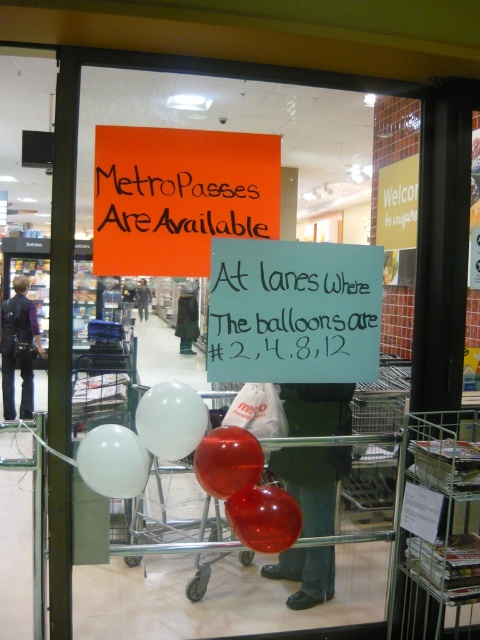
In the scene shown: You are a customer entering the store through the glass door. You see a white chalk sign at center and a glossy red balloon at center. Which object is taller?

The white chalk sign at center is much taller than the glossy red balloon at center.

You are a delivery person trying to locate the MetroPasses in the store. You see the white chalk sign at center and the matte black jacket at upper center. Which object is nearer to you through the glass door?

The white chalk sign at center is closer to the viewer than the matte black jacket at upper center.